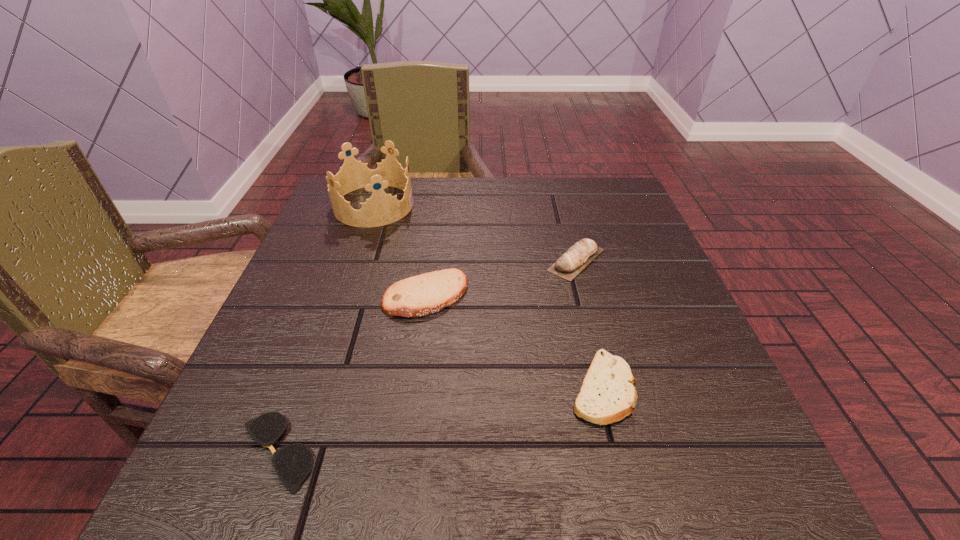
The height and width of the screenshot is (540, 960). What are the coordinates of `object that ranks as the closest to the leftmost pita bread` in the screenshot? It's located at (570, 264).

Identify which object is located as the fourth nearest to the nearest pita bread. Please provide its 2D coordinates. Your answer should be formatted as a tuple, i.e. [(x, y)], where the tuple contains the x and y coordinates of a point satisfying the conditions above.

[(380, 209)]

Locate an element on the screen. Image resolution: width=960 pixels, height=540 pixels. pita bread that stands as the closest to the shortest pita bread is located at coordinates (424, 294).

Where is `pita bread object that ranks as the third closest to the spectacles`? pita bread object that ranks as the third closest to the spectacles is located at coordinates (570, 264).

This screenshot has height=540, width=960. I want to click on blank space that satisfies the following two spatial constraints: 1. on the back side of the leftmost pita bread; 2. on the front-facing side of the tallest object, so click(x=438, y=205).

Find the location of `vacant space that satisfies the following two spatial constraints: 1. on the back side of the leftmost pita bread; 2. on the front-facing side of the farthest object`. vacant space that satisfies the following two spatial constraints: 1. on the back side of the leftmost pita bread; 2. on the front-facing side of the farthest object is located at coordinates click(x=438, y=205).

This screenshot has height=540, width=960. In order to click on free space in the image that satisfies the following two spatial constraints: 1. on the back side of the leftmost pita bread; 2. on the front-facing side of the tiara in this screenshot , I will do `click(438, 205)`.

Find the location of a particular element. The image size is (960, 540). vacant space that satisfies the following two spatial constraints: 1. on the back side of the leftmost pita bread; 2. on the front-facing side of the farthest object is located at coordinates (438, 205).

Where is `free spot that satisfies the following two spatial constraints: 1. on the front-facing side of the tallest object; 2. on the left side of the leftmost pita bread`? The width and height of the screenshot is (960, 540). free spot that satisfies the following two spatial constraints: 1. on the front-facing side of the tallest object; 2. on the left side of the leftmost pita bread is located at coordinates (342, 296).

Where is `free location that satisfies the following two spatial constraints: 1. on the front-facing side of the leftmost pita bread; 2. on the left side of the tallest object`? free location that satisfies the following two spatial constraints: 1. on the front-facing side of the leftmost pita bread; 2. on the left side of the tallest object is located at coordinates (342, 296).